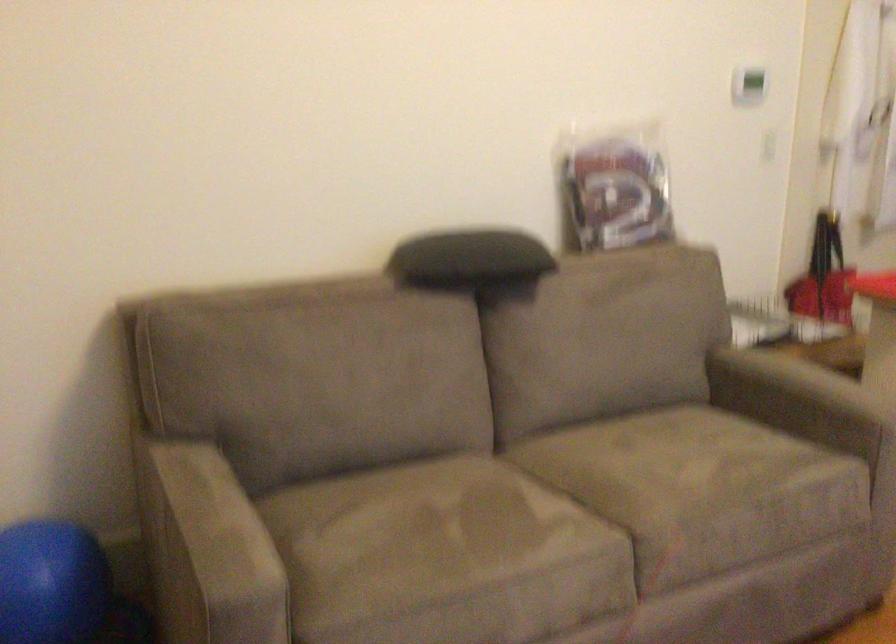
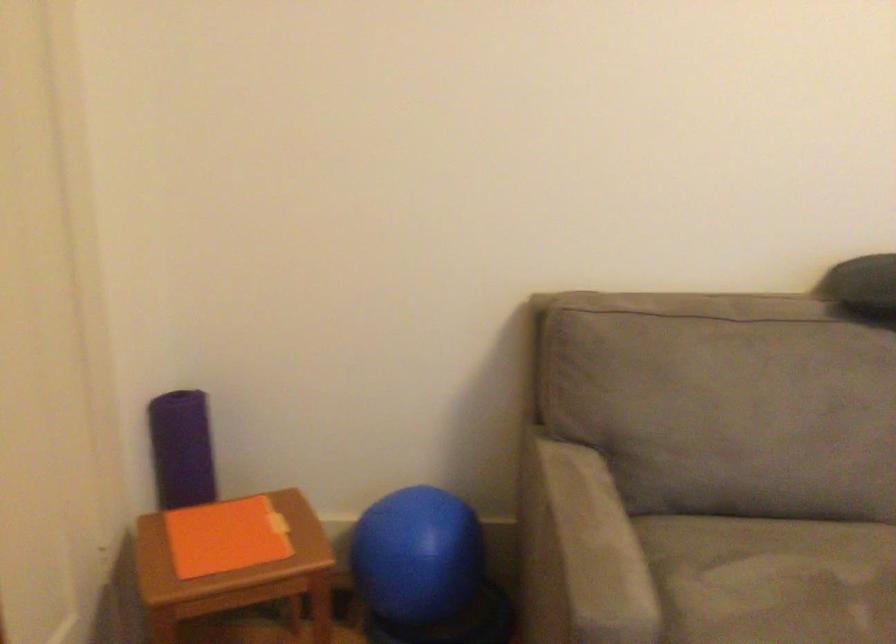
The point at (209,534) is marked in the first image. Where is the corresponding point in the second image?

(588, 550)